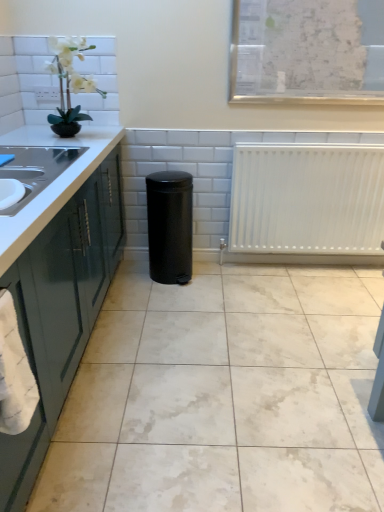
Question: From the image's perspective, is black matte trash can at center above or below white glossy countertop at left, the second countertop positioned from the top?

Choices:
 (A) above
 (B) below

Answer: (A)

Question: From a real-world perspective, is black matte trash can at center physically located above or below white glossy countertop at left, the second countertop positioned from the top?

Choices:
 (A) below
 (B) above

Answer: (A)

Question: Which object is the farthest from the white glossy countertop at left, arranged as the first countertop when viewed from the top?

Choices:
 (A) white glossy countertop at left, the second countertop positioned from the top
 (B) white towel at left
 (C) white matte orchid at upper left
 (D) white marble floor at center
 (E) white matte radiator at center

Answer: (E)

Question: Considering the real-world distances, which object is farthest from the white towel at left?

Choices:
 (A) white matte radiator at center
 (B) black matte trash can at center
 (C) white marble floor at center
 (D) white glossy countertop at left, arranged as the first countertop when viewed from the top
 (E) white glossy countertop at left, the second countertop positioned from the top

Answer: (A)